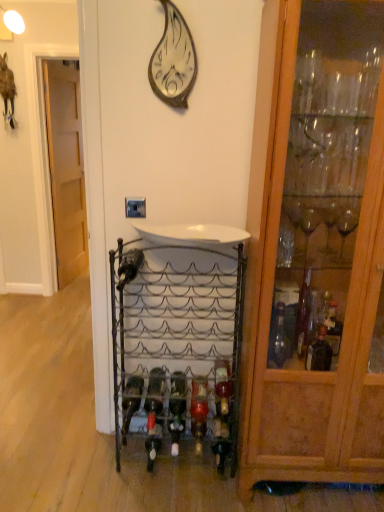
Question: Considering the positions of white glossy sink at center and wooden cabinet at right in the image, is white glossy sink at center bigger or smaller than wooden cabinet at right?

Choices:
 (A) big
 (B) small

Answer: (B)

Question: Does point (218, 230) appear closer or farther from the camera than point (380, 208)?

Choices:
 (A) closer
 (B) farther

Answer: (B)

Question: Which object is the farthest from the metallic silver wall clock at upper center?

Choices:
 (A) white glossy sink at center
 (B) light brown wood door at left
 (C) wooden cabinet at right
 (D) metallic wine rack at center

Answer: (B)

Question: Considering the real-world distances, which object is farthest from the wooden cabinet at right?

Choices:
 (A) light brown wood door at left
 (B) white glossy sink at center
 (C) metallic wine rack at center
 (D) metallic silver wall clock at upper center

Answer: (A)